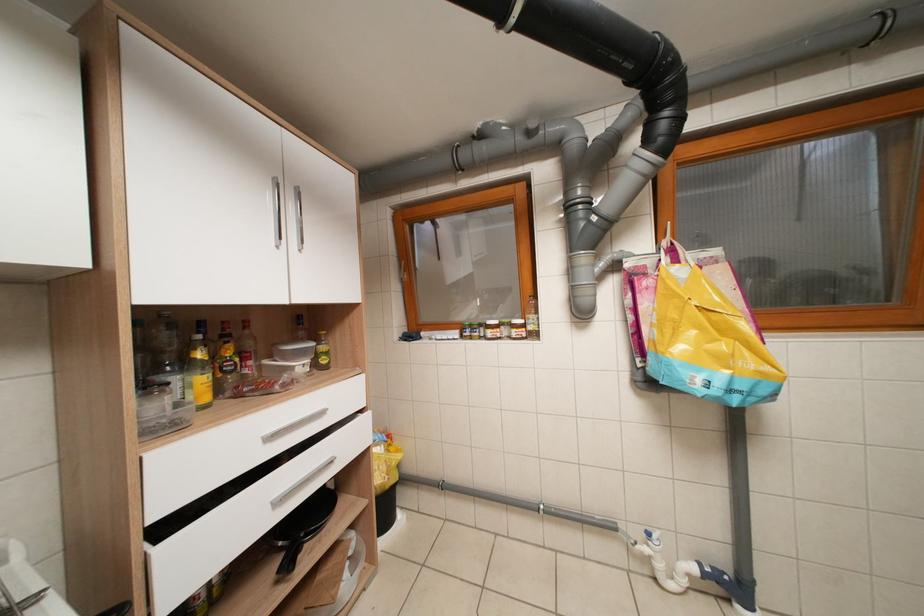
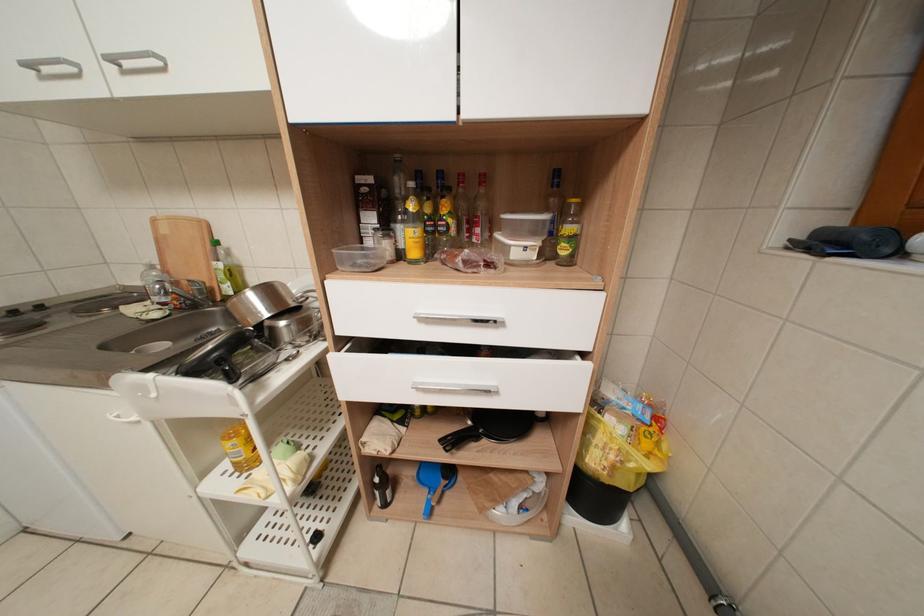
Based on the continuous images, in which direction is the camera rotating?

The camera's rotation is toward left-down.